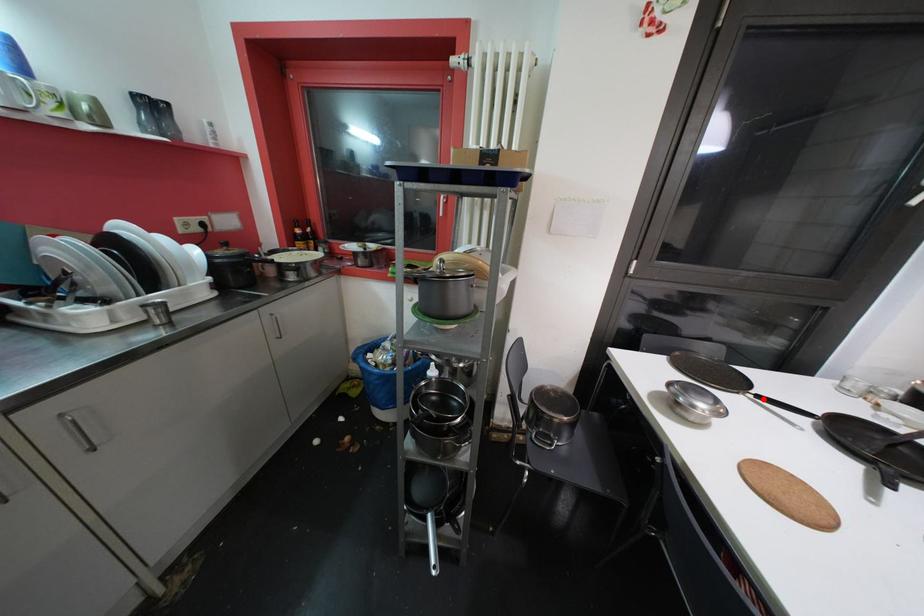
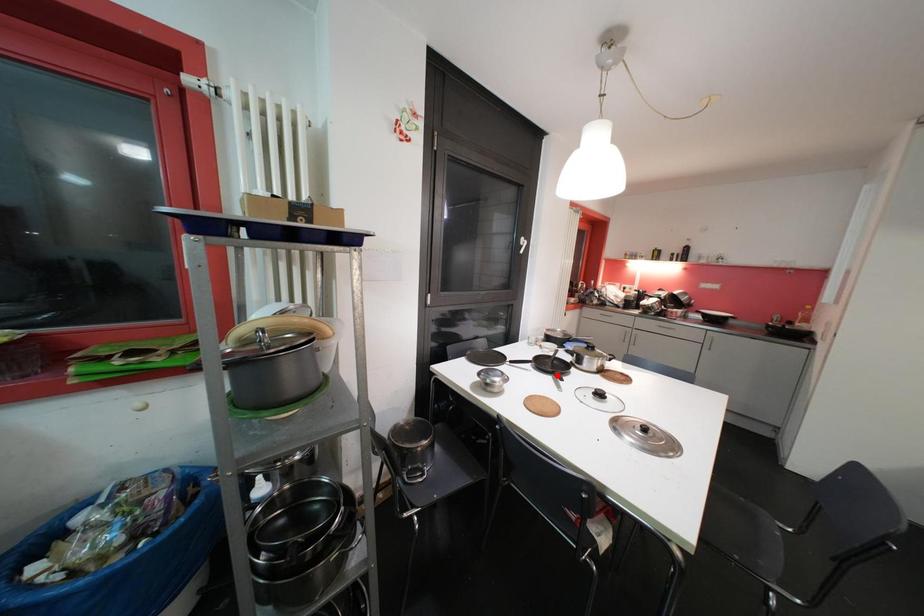
I am providing you with two images of the same scene from different viewpoints. A red point is marked on the first image and another point is marked on the second image. Are the points marked in image1 and image2 representing the same 3D position?

→ No